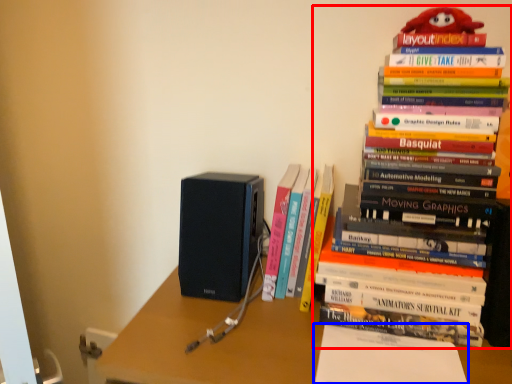
Question: Among these objects, which one is nearest to the camera, book (highlighted by a red box) or paperback book (highlighted by a blue box)?

Choices:
 (A) book
 (B) paperback book

Answer: (A)